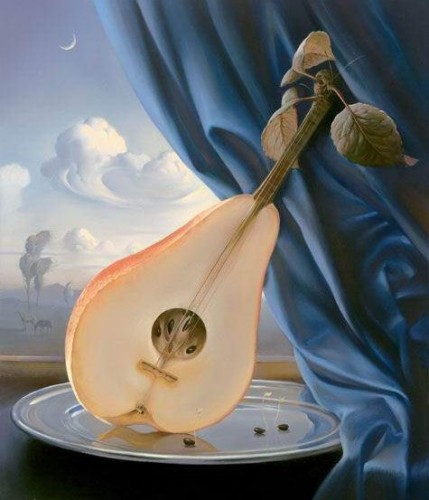
Identify the location of colorful piece of artwork. (172, 201).